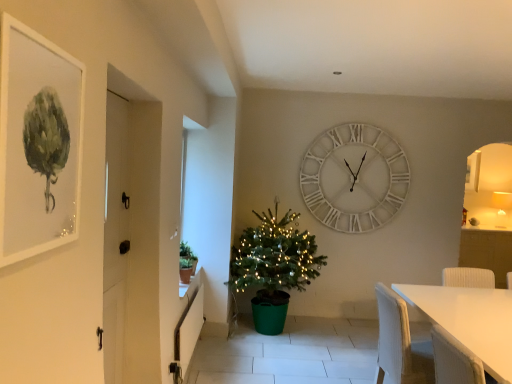
Question: Is white matte table at lower right smaller than matte white picture frame at upper left?

Choices:
 (A) no
 (B) yes

Answer: (A)

Question: Can you confirm if white matte table at lower right is bigger than matte white picture frame at upper left?

Choices:
 (A) no
 (B) yes

Answer: (B)

Question: Are white matte table at lower right and matte white picture frame at upper left making contact?

Choices:
 (A) no
 (B) yes

Answer: (A)

Question: Does white matte table at lower right appear on the left side of matte white picture frame at upper left?

Choices:
 (A) no
 (B) yes

Answer: (A)

Question: Is white matte table at lower right turned away from matte white picture frame at upper left?

Choices:
 (A) no
 (B) yes

Answer: (A)

Question: From the image's perspective, would you say white matte table at lower right is shown under matte white picture frame at upper left?

Choices:
 (A) yes
 (B) no

Answer: (A)

Question: Is white matte table at lower right outside white wooden door at left?

Choices:
 (A) no
 (B) yes

Answer: (B)

Question: Is the position of white matte table at lower right less distant than that of white wooden door at left?

Choices:
 (A) yes
 (B) no

Answer: (B)

Question: Is white matte table at lower right wider than white wooden door at left?

Choices:
 (A) yes
 (B) no

Answer: (A)

Question: Is white matte table at lower right further to camera compared to white wooden door at left?

Choices:
 (A) no
 (B) yes

Answer: (B)

Question: From the image's perspective, is white matte table at lower right beneath white wooden door at left?

Choices:
 (A) yes
 (B) no

Answer: (A)

Question: From a real-world perspective, is white matte table at lower right located higher than white wooden door at left?

Choices:
 (A) yes
 (B) no

Answer: (B)

Question: Is green matte plant at left to the right of white wooden door at left from the viewer's perspective?

Choices:
 (A) yes
 (B) no

Answer: (A)